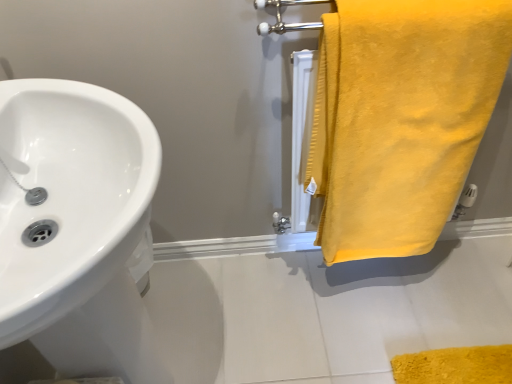
Question: Should I look upward or downward to see white glossy sink at left?

Choices:
 (A) down
 (B) up

Answer: (A)

Question: Does yellow soft towel at right have a lesser height compared to white glossy sink at left?

Choices:
 (A) no
 (B) yes

Answer: (B)

Question: Can you confirm if yellow soft towel at right is wider than white glossy sink at left?

Choices:
 (A) no
 (B) yes

Answer: (A)

Question: Is yellow soft towel at right beside white glossy sink at left?

Choices:
 (A) no
 (B) yes

Answer: (A)

Question: Is yellow soft towel at right outside of white glossy sink at left?

Choices:
 (A) yes
 (B) no

Answer: (A)

Question: Are yellow soft towel at right and white glossy sink at left located far from each other?

Choices:
 (A) yes
 (B) no

Answer: (B)

Question: From a real-world perspective, is yellow soft towel at right below white glossy sink at left?

Choices:
 (A) no
 (B) yes

Answer: (A)

Question: From a real-world perspective, does white glossy sink at left stand above yellow soft towel at right?

Choices:
 (A) yes
 (B) no

Answer: (B)

Question: Can you confirm if white glossy sink at left is wider than yellow soft towel at right?

Choices:
 (A) no
 (B) yes

Answer: (B)

Question: Is white glossy sink at left bigger than yellow soft towel at right?

Choices:
 (A) no
 (B) yes

Answer: (B)

Question: Is white glossy sink at left far away from yellow soft towel at right?

Choices:
 (A) no
 (B) yes

Answer: (A)

Question: Is white glossy sink at left oriented away from yellow soft towel at right?

Choices:
 (A) yes
 (B) no

Answer: (B)

Question: Is white glossy sink at left taller than yellow soft towel at right?

Choices:
 (A) no
 (B) yes

Answer: (B)

Question: Based on their positions, is yellow soft towel at right located to the left or right of white glossy sink at left?

Choices:
 (A) right
 (B) left

Answer: (A)